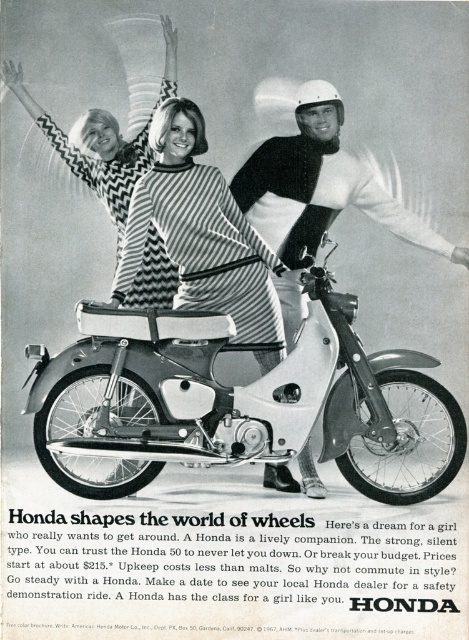
Who is positioned more to the right, white matte motorcycle at center or striped fabric dress at center?

white matte motorcycle at center

Does white matte motorcycle at center appear over striped fabric dress at center?

Incorrect, white matte motorcycle at center is not positioned above striped fabric dress at center.

This screenshot has height=640, width=469. What do you see at coordinates (226, 400) in the screenshot?
I see `white matte motorcycle at center` at bounding box center [226, 400].

Where is `white matte motorcycle at center`? white matte motorcycle at center is located at coordinates (226, 400).

Between white matte motorcycle at center and white helmet at center, which one appears on the left side from the viewer's perspective?

white matte motorcycle at center

Can you confirm if white matte motorcycle at center is wider than white helmet at center?

Yes.

Where is `white matte motorcycle at center`? This screenshot has height=640, width=469. white matte motorcycle at center is located at coordinates (226, 400).

Which is more to the right, striped fabric dress at center or white helmet at center?

white helmet at center is more to the right.

What do you see at coordinates (199, 230) in the screenshot?
I see `striped fabric dress at center` at bounding box center [199, 230].

Where is `striped fabric dress at center`? This screenshot has height=640, width=469. striped fabric dress at center is located at coordinates (199, 230).